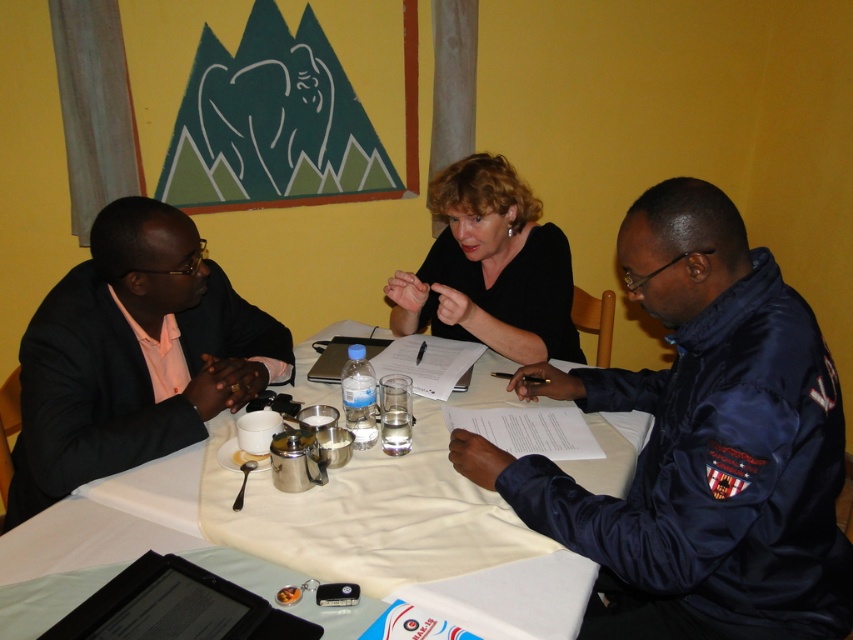
Question: Which object is the farthest from the white cloth at center?

Choices:
 (A) black satin suit at left
 (B) black matte shirt at center

Answer: (B)

Question: Observing the image, what is the correct spatial positioning of black satin suit at left in reference to white cloth at center?

Choices:
 (A) right
 (B) left

Answer: (B)

Question: Based on their relative distances, which object is nearer to the black matte shirt at center?

Choices:
 (A) navy blue uniform at center
 (B) white cloth at center
 (C) black satin suit at left

Answer: (B)

Question: Can you confirm if black satin suit at left is bigger than black matte shirt at center?

Choices:
 (A) yes
 (B) no

Answer: (A)

Question: Estimate the real-world distances between objects in this image. Which object is farther from the navy blue uniform at center?

Choices:
 (A) white cloth at center
 (B) black matte shirt at center

Answer: (B)

Question: Does navy blue uniform at center appear under black matte shirt at center?

Choices:
 (A) yes
 (B) no

Answer: (A)